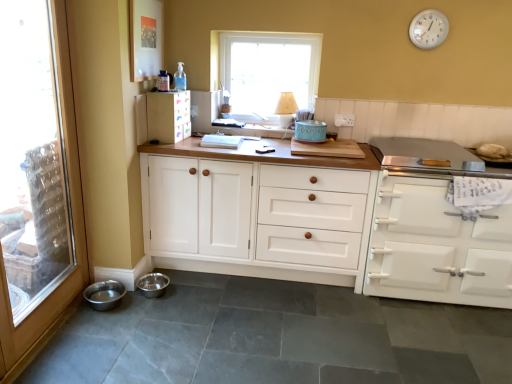
Question: Choose the correct answer: Is matte white cabinet at upper left, the first cabinetry in the left-to-right sequence, inside wooden lampshade at upper center or outside it?

Choices:
 (A) inside
 (B) outside

Answer: (B)

Question: Based on their sizes in the image, would you say matte white cabinet at upper left, the first cabinetry in the left-to-right sequence, is bigger or smaller than wooden lampshade at upper center?

Choices:
 (A) big
 (B) small

Answer: (A)

Question: Which object is the farthest from the matte white cabinet at upper left, the first cabinetry in the left-to-right sequence?

Choices:
 (A) white frame window at upper center
 (B) white matte oven at right, marked as the third cabinetry in a left-to-right arrangement
 (C) white plastic clock at upper right
 (D) transparent glass door at left
 (E) white wood cabinet at center, the second cabinetry in the right-to-left sequence

Answer: (C)

Question: Which object is the closest to the teal ceramic container at center?

Choices:
 (A) matte white cabinet at upper left, the first cabinetry in the left-to-right sequence
 (B) white matte oven at right, marked as the third cabinetry in a left-to-right arrangement
 (C) transparent glass door at left
 (D) white frame window at upper center
 (E) white wood cabinet at center, the second cabinetry in the right-to-left sequence

Answer: (D)